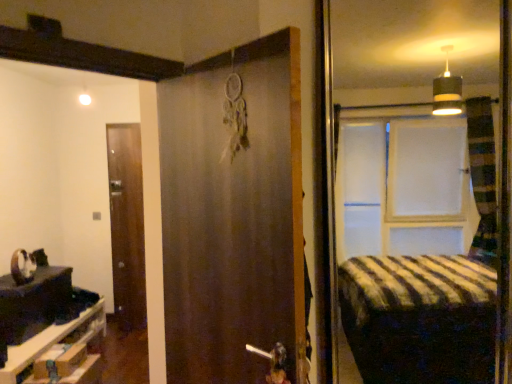
In the scene shown: What is the approximate width of brown matte door at center, marked as the second door in a left-to-right arrangement?

It is 6.76 inches.

Describe the element at coordinates (60, 353) in the screenshot. This screenshot has width=512, height=384. I see `wooden drawer at lower left` at that location.

What do you see at coordinates (127, 225) in the screenshot? The width and height of the screenshot is (512, 384). I see `brown wooden door at left, marked as the second door in a front-to-back arrangement` at bounding box center [127, 225].

Locate an element on the screen. black glossy table at lower left is located at coordinates (33, 303).

Based on their sizes in the image, would you say wooden drawer at lower left is bigger or smaller than brown wooden door at left, marked as the second door in a front-to-back arrangement?

Clearly, wooden drawer at lower left is larger in size than brown wooden door at left, marked as the second door in a front-to-back arrangement.

In the image, is wooden drawer at lower left on the left side or the right side of brown wooden door at left, positioned as the 1th door in back-to-front order?

Clearly, wooden drawer at lower left is on the left of brown wooden door at left, positioned as the 1th door in back-to-front order, in the image.

Locate an element on the screen. furniture that is under the brown wooden door at left, positioned as the 1th door in back-to-front order (from a real-world perspective) is located at coordinates (60, 353).

From a real-world perspective, which is physically above, wooden drawer at lower left or brown wooden door at left, marked as the second door in a front-to-back arrangement?

From a 3D spatial view, brown wooden door at left, marked as the second door in a front-to-back arrangement, is above.

Does wooden drawer at lower left have a greater width compared to brown matte door at center, the 1th door in the front-to-back sequence?

Indeed, wooden drawer at lower left has a greater width compared to brown matte door at center, the 1th door in the front-to-back sequence.

Considering the positions of objects wooden drawer at lower left and brown matte door at center, marked as the second door in a left-to-right arrangement, in the image provided, who is in front, wooden drawer at lower left or brown matte door at center, marked as the second door in a left-to-right arrangement,?

brown matte door at center, marked as the second door in a left-to-right arrangement, is in front.

Would you say brown matte door at center, the 1th door in the front-to-back sequence, is part of wooden drawer at lower left's contents?

No.

Would you say brown wooden door at left, which is counted as the first door, starting from the left, is inside or outside wooden drawer at lower left?

The correct answer is: outside.

Looking at this image, between brown wooden door at left, marked as the second door in a front-to-back arrangement, and wooden drawer at lower left, which one appears on the left side from the viewer's perspective?

wooden drawer at lower left is more to the left.

Can you tell me how much brown wooden door at left, positioned as the 1th door in back-to-front order, and wooden drawer at lower left differ in facing direction?

The facing directions of brown wooden door at left, positioned as the 1th door in back-to-front order, and wooden drawer at lower left are 86.3 degrees apart.

Is brown wooden door at left, which is counted as the 2th door, starting from the right, looking in the opposite direction of wooden drawer at lower left?

No, brown wooden door at left, which is counted as the 2th door, starting from the right,'s orientation is not away from wooden drawer at lower left.

Is black glossy table at lower left turned away from brown wooden door at left, positioned as the 1th door in back-to-front order?

That's not correct — black glossy table at lower left is not looking away from brown wooden door at left, positioned as the 1th door in back-to-front order.

Between point (33, 329) and point (138, 317), which one is positioned in front?

The point (33, 329) is more forward.

Does black glossy table at lower left have a greater height compared to brown wooden door at left, which is counted as the first door, starting from the left?

No.

Which is more to the right, brown matte door at center, the 1th door in the right-to-left sequence, or wooden drawer at lower left?

Positioned to the right is brown matte door at center, the 1th door in the right-to-left sequence.

Between point (209, 200) and point (53, 378), which one is positioned in front?

The point (209, 200) is more forward.

Is brown matte door at center, marked as the second door in a left-to-right arrangement, not inside wooden drawer at lower left?

That's correct, brown matte door at center, marked as the second door in a left-to-right arrangement, is outside of wooden drawer at lower left.

How different are the orientations of brown matte door at center, marked as the second door in a left-to-right arrangement, and wooden drawer at lower left in degrees?

They differ by 137 degrees in their facing directions.

Is brown matte door at center, marked as the second door in a left-to-right arrangement, facing towards black glossy table at lower left?

No, brown matte door at center, marked as the second door in a left-to-right arrangement, is not oriented towards black glossy table at lower left.

Is black glossy table at lower left surrounded by brown matte door at center, the 1th door in the right-to-left sequence?

No, black glossy table at lower left is located outside of brown matte door at center, the 1th door in the right-to-left sequence.

Is brown matte door at center, the 1th door in the right-to-left sequence, positioned far away from black glossy table at lower left?

Yes, brown matte door at center, the 1th door in the right-to-left sequence, and black glossy table at lower left are quite far apart.

Between wooden drawer at lower left and black glossy table at lower left, which one has less height?

With less height is wooden drawer at lower left.

Is wooden drawer at lower left beside black glossy table at lower left?

wooden drawer at lower left is not next to black glossy table at lower left, and they're not touching.

Considering the relative sizes of wooden drawer at lower left and black glossy table at lower left in the image provided, is wooden drawer at lower left smaller than black glossy table at lower left?

No, wooden drawer at lower left is not smaller than black glossy table at lower left.

Which of these two, wooden drawer at lower left or black glossy table at lower left, is wider?

wooden drawer at lower left is wider.

Locate an element on the screen. The image size is (512, 384). furniture located on the left of brown wooden door at left, which is counted as the 2th door, starting from the right is located at coordinates (60, 353).

Find the location of `furniture that appears below the brown matte door at center, the 1th door in the front-to-back sequence (from the image's perspective)`. furniture that appears below the brown matte door at center, the 1th door in the front-to-back sequence (from the image's perspective) is located at coordinates (60, 353).

When comparing their distances from black glossy table at lower left, does brown matte door at center, marked as the second door in a left-to-right arrangement, or wooden drawer at lower left seem closer?

The object closer to black glossy table at lower left is wooden drawer at lower left.

When comparing their distances from black glossy table at lower left, does brown wooden door at left, which is counted as the first door, starting from the left, or brown matte door at center, the 1th door in the front-to-back sequence, seem closer?

brown wooden door at left, which is counted as the first door, starting from the left.

From the image, which object appears to be farther from wooden drawer at lower left, black glossy table at lower left or brown matte door at center, positioned as the 2th door in back-to-front order?

brown matte door at center, positioned as the 2th door in back-to-front order, is further to wooden drawer at lower left.

Estimate the real-world distances between objects in this image. Which object is closer to black glossy table at lower left, brown matte door at center, the 1th door in the right-to-left sequence, or brown wooden door at left, which is counted as the 2th door, starting from the right?

brown wooden door at left, which is counted as the 2th door, starting from the right, is closer to black glossy table at lower left.

Looking at the image, which one is located further to wooden drawer at lower left, brown wooden door at left, which is counted as the 2th door, starting from the right, or brown matte door at center, positioned as the 2th door in back-to-front order?

brown matte door at center, positioned as the 2th door in back-to-front order, lies further to wooden drawer at lower left than the other object.

From the image, which object appears to be farther from brown wooden door at left, positioned as the 1th door in back-to-front order, brown matte door at center, positioned as the 2th door in back-to-front order, or wooden drawer at lower left?

brown matte door at center, positioned as the 2th door in back-to-front order, is positioned further to the anchor brown wooden door at left, positioned as the 1th door in back-to-front order.

When comparing their distances from brown wooden door at left, which is counted as the first door, starting from the left, does wooden drawer at lower left or black glossy table at lower left seem further?

wooden drawer at lower left.

Looking at the image, which one is located closer to brown matte door at center, the 1th door in the right-to-left sequence, wooden drawer at lower left or black glossy table at lower left?

The object closer to brown matte door at center, the 1th door in the right-to-left sequence, is wooden drawer at lower left.

Identify the location of furniture positioned between brown matte door at center, marked as the second door in a left-to-right arrangement, and black glossy table at lower left from near to far. (60, 353).

Find the location of a particular element. The image size is (512, 384). table between wooden drawer at lower left and brown wooden door at left, which is counted as the 2th door, starting from the right, in the front-back direction is located at coordinates (33, 303).

Find the location of a particular element. This screenshot has height=384, width=512. table between brown matte door at center, the 1th door in the front-to-back sequence, and brown wooden door at left, marked as the second door in a front-to-back arrangement, from front to back is located at coordinates (33, 303).

Where is `furniture positioned between brown matte door at center, marked as the second door in a left-to-right arrangement, and brown wooden door at left, which is counted as the first door, starting from the left, from near to far`? furniture positioned between brown matte door at center, marked as the second door in a left-to-right arrangement, and brown wooden door at left, which is counted as the first door, starting from the left, from near to far is located at coordinates (60, 353).